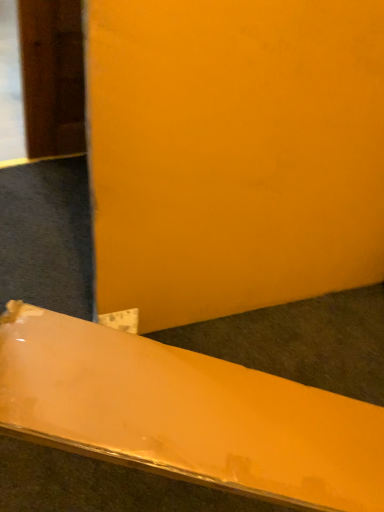
I want to click on empty space that is ontop of matte orange board at lower center (from a real-world perspective), so click(203, 405).